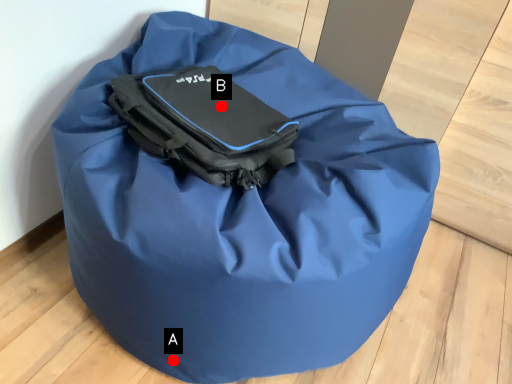
Question: Two points are circled on the image, labeled by A and B beside each circle. Which point is closer to the camera?

Choices:
 (A) A is closer
 (B) B is closer

Answer: (A)